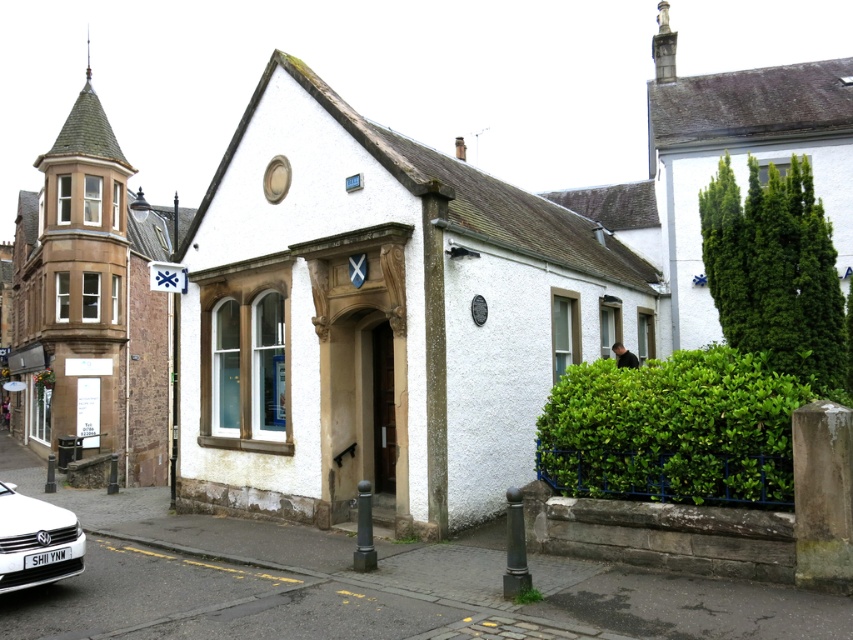
Question: Which point is farther to the camera?

Choices:
 (A) (4, 579)
 (B) (602, 428)

Answer: (B)

Question: Among these points, which one is farthest from the camera?

Choices:
 (A) (57, 572)
 (B) (643, 451)

Answer: (B)

Question: Is green leafy bush at right wider than white matte car at lower left?

Choices:
 (A) no
 (B) yes

Answer: (B)

Question: Can you confirm if green leafy bush at right is thinner than white matte car at lower left?

Choices:
 (A) yes
 (B) no

Answer: (B)

Question: Can you confirm if green leafy bush at right is wider than white matte car at lower left?

Choices:
 (A) yes
 (B) no

Answer: (A)